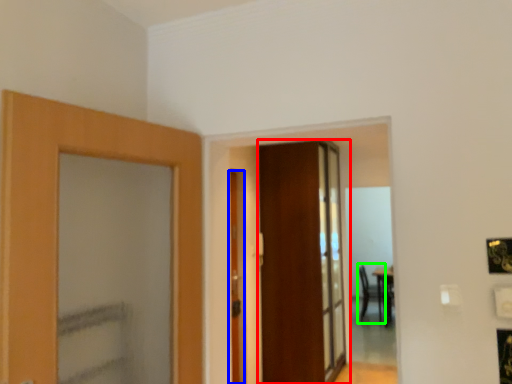
Question: Based on their relative distances, which object is nearer to door (highlighted by a red box)? Choose from door (highlighted by a blue box) and armchair (highlighted by a green box).

Choices:
 (A) door
 (B) armchair

Answer: (A)